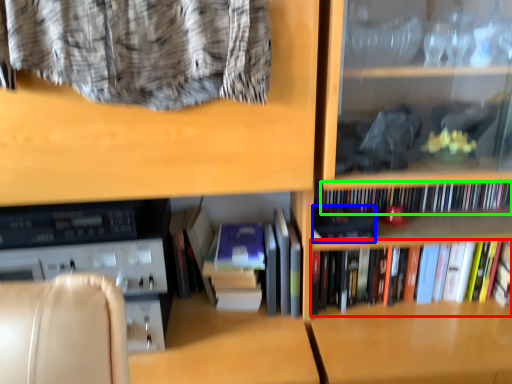
Question: Which object is positioned closest to book (highlighted by a red box)? Select from paperback book (highlighted by a blue box) and book (highlighted by a green box).

Choices:
 (A) paperback book
 (B) book

Answer: (B)